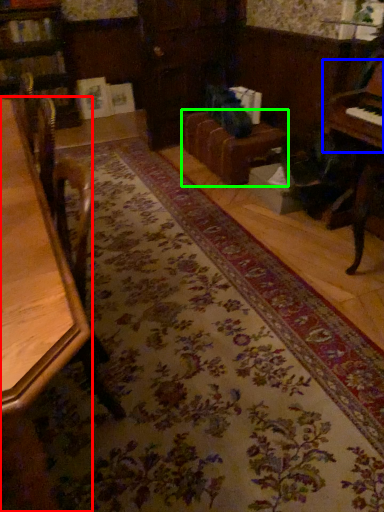
Question: Which is nearer to the table (highlighted by a red box)? piano (highlighted by a blue box) or couch (highlighted by a green box).

Choices:
 (A) piano
 (B) couch

Answer: (A)